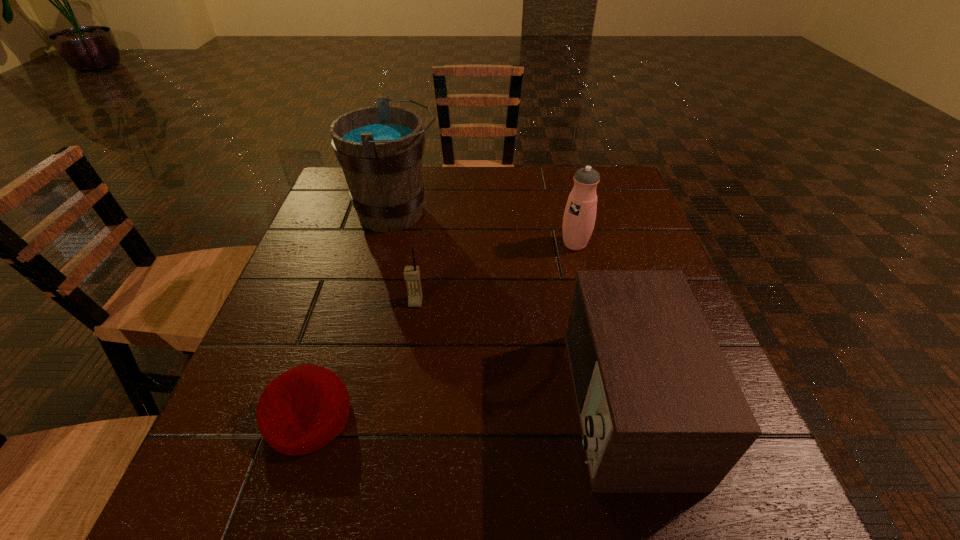
Locate an element on the screen. vacant area located 0.050m on the front-facing side of the radio receiver is located at coordinates (536, 404).

This screenshot has width=960, height=540. I want to click on vacant area located on the front of the fourth tallest object, where the keypad is located, so [x=402, y=393].

Identify the location of object located at the far edge. Image resolution: width=960 pixels, height=540 pixels. (380, 148).

I want to click on object located in the near edge section of the desktop, so pos(660,410).

Where is `wine bucket positioned at the left edge`? wine bucket positioned at the left edge is located at coordinates (380, 148).

Where is `beanbag that is at the left edge`? beanbag that is at the left edge is located at coordinates (302, 410).

At what (x,y) coordinates should I click in order to perform the action: click on thermos bottle present at the right edge. Please return your answer as a coordinate pair (x, y). This screenshot has width=960, height=540. Looking at the image, I should click on (579, 218).

This screenshot has height=540, width=960. Identify the location of radio receiver present at the right edge. [660, 410].

In order to click on object that is at the far left corner in this screenshot , I will do `click(380, 148)`.

Find the location of a particular element. object at the near right corner is located at coordinates tap(660, 410).